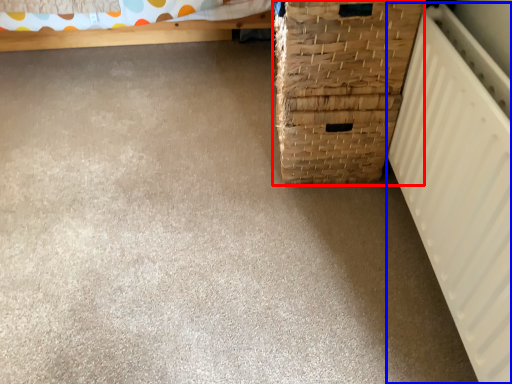
Question: Which object appears closest to the camera in this image, basket container (highlighted by a red box) or radiator (highlighted by a blue box)?

Choices:
 (A) basket container
 (B) radiator

Answer: (B)